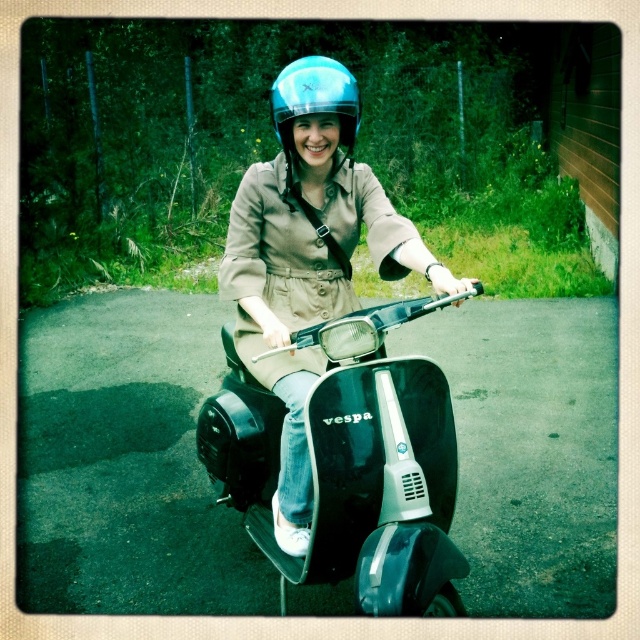
Does black glossy vespa at center have a smaller size compared to blue glossy helmet at center?

Actually, black glossy vespa at center might be larger than blue glossy helmet at center.

Is black glossy vespa at center bigger than blue glossy helmet at center?

Yes, black glossy vespa at center is bigger than blue glossy helmet at center.

Where is `black glossy vespa at center`? This screenshot has height=640, width=640. black glossy vespa at center is located at coordinates (352, 464).

Looking at this image, which is below, black glossy vespa at center or matte blue helmet at center?

Positioned lower is black glossy vespa at center.

Does black glossy vespa at center have a greater width compared to matte blue helmet at center?

Yes, black glossy vespa at center is wider than matte blue helmet at center.

Measure the distance between point (x=388, y=554) and camera.

Point (x=388, y=554) is 6.32 feet away from camera.

The height and width of the screenshot is (640, 640). What are the coordinates of `black glossy vespa at center` in the screenshot? It's located at (352, 464).

Between matte blue helmet at center and blue glossy helmet at center, which one appears on the right side from the viewer's perspective?

matte blue helmet at center is more to the right.

Is matte blue helmet at center wider than blue glossy helmet at center?

Indeed, matte blue helmet at center has a greater width compared to blue glossy helmet at center.

Which is in front, point (292, 536) or point (269, 99)?

Positioned in front is point (292, 536).

The width and height of the screenshot is (640, 640). Find the location of `matte blue helmet at center`. matte blue helmet at center is located at coordinates pyautogui.click(x=308, y=256).